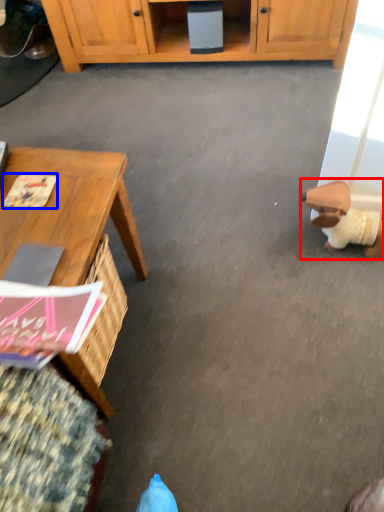
Question: Which of the following is the farthest to the observer, toy (highlighted by a red box) or magazine (highlighted by a blue box)?

Choices:
 (A) toy
 (B) magazine

Answer: (A)